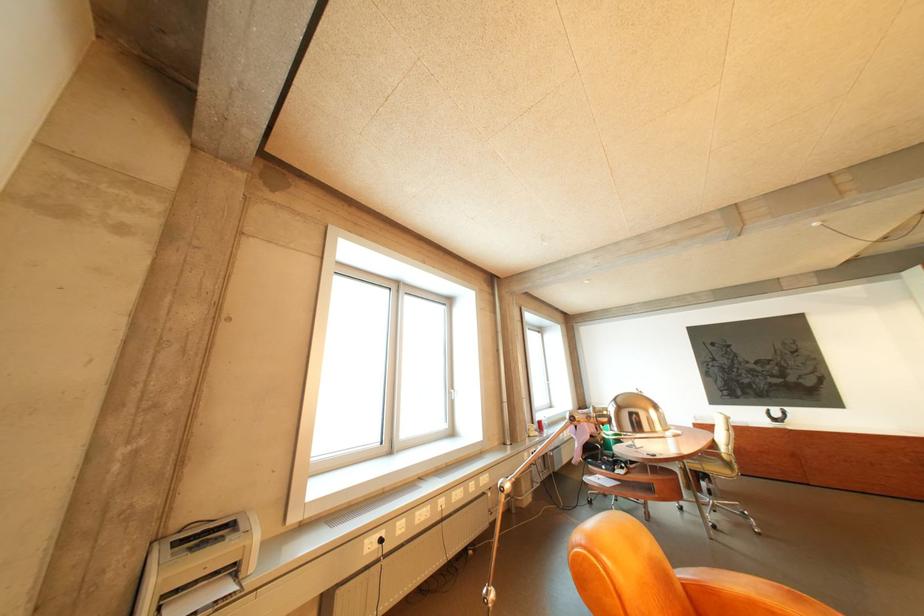
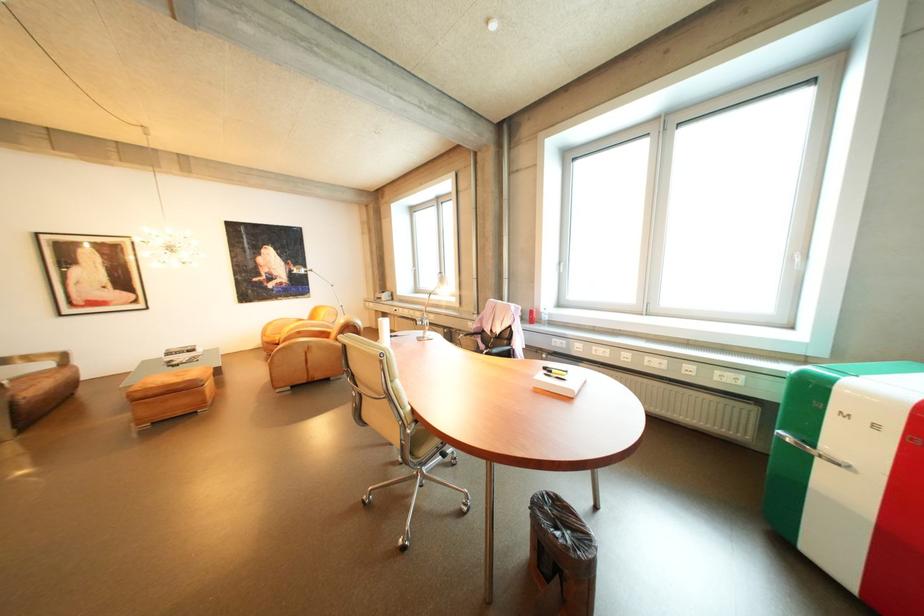
Question: I am providing you with two images of the same scene from different viewpoints. After the viewpoint changes to image2, which objects are now occluded?

Choices:
 (A) silver lamp head
 (B) leaning picture frame
 (C) silver refrigerator handle
 (D) white window handle

Answer: (A)